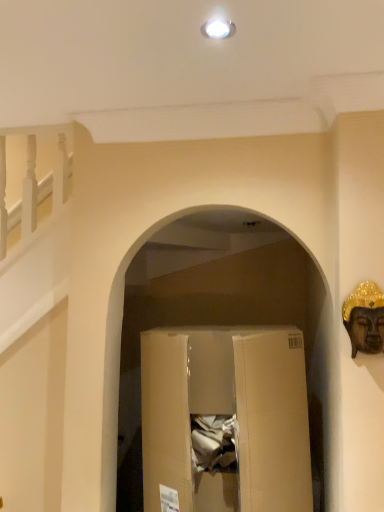
Question: Is brown cardboard box at center to the left of gold metallic buddha head at right from the viewer's perspective?

Choices:
 (A) no
 (B) yes

Answer: (B)

Question: Is gold metallic buddha head at right a part of brown cardboard box at center?

Choices:
 (A) yes
 (B) no

Answer: (B)

Question: Can you confirm if brown cardboard box at center is positioned to the right of gold metallic buddha head at right?

Choices:
 (A) yes
 (B) no

Answer: (B)

Question: Is brown cardboard box at center positioned before gold metallic buddha head at right?

Choices:
 (A) no
 (B) yes

Answer: (A)

Question: Is brown cardboard box at center completely or partially outside of gold metallic buddha head at right?

Choices:
 (A) yes
 (B) no

Answer: (A)

Question: Can you see brown cardboard box at center touching gold metallic buddha head at right?

Choices:
 (A) yes
 (B) no

Answer: (B)

Question: Is gold metallic buddha head at right positioned beyond the bounds of brown cardboard box at center?

Choices:
 (A) no
 (B) yes

Answer: (B)

Question: Is gold metallic buddha head at right aimed at brown cardboard box at center?

Choices:
 (A) yes
 (B) no

Answer: (B)

Question: Is brown cardboard box at center inside gold metallic buddha head at right?

Choices:
 (A) no
 (B) yes

Answer: (A)

Question: Is the depth of gold metallic buddha head at right less than that of brown cardboard box at center?

Choices:
 (A) yes
 (B) no

Answer: (A)

Question: From the image's perspective, is gold metallic buddha head at right under brown cardboard box at center?

Choices:
 (A) yes
 (B) no

Answer: (B)

Question: From a real-world perspective, is gold metallic buddha head at right physically above brown cardboard box at center?

Choices:
 (A) yes
 (B) no

Answer: (A)

Question: Is brown cardboard box at center to the left or to the right of gold metallic buddha head at right in the image?

Choices:
 (A) right
 (B) left

Answer: (B)